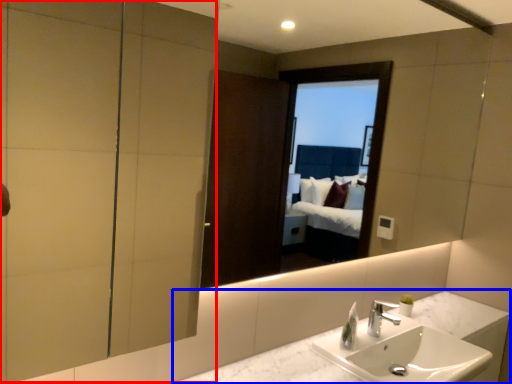
Question: Which object appears closest to the camera in this image, screen door (highlighted by a red box) or counter top (highlighted by a blue box)?

Choices:
 (A) screen door
 (B) counter top

Answer: (A)